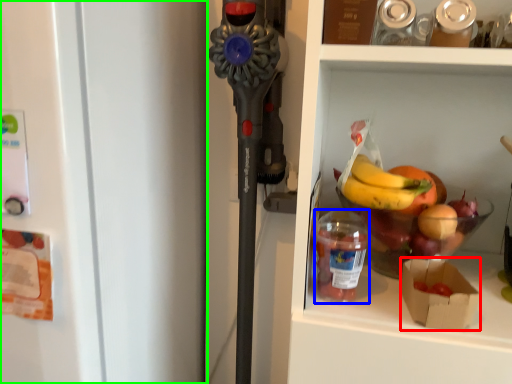
Question: Based on their relative distances, which object is nearer to box (highlighted by a red box)? Choose from bottle (highlighted by a blue box) and refrigerator (highlighted by a green box).

Choices:
 (A) bottle
 (B) refrigerator

Answer: (A)